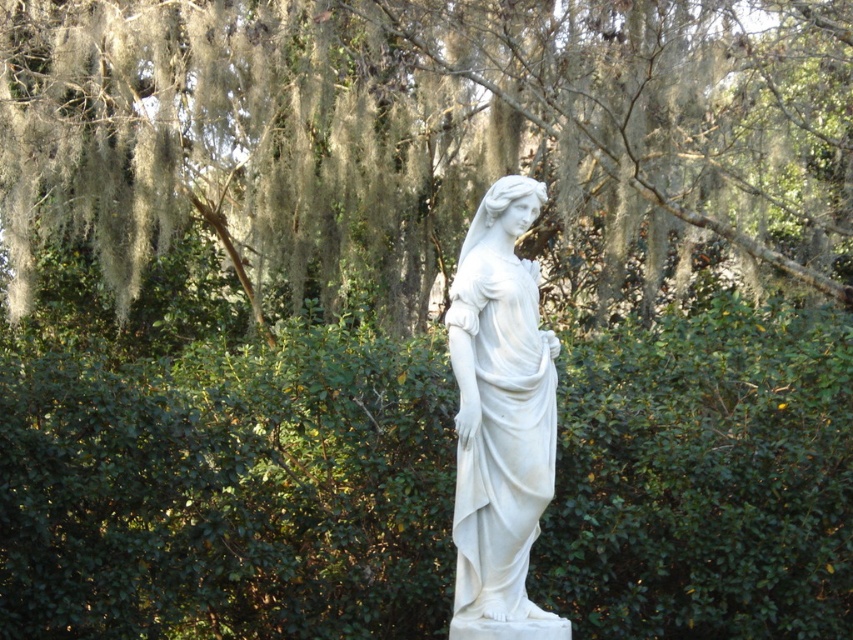
You are a gardener planning to place a new bench between the green mossy tree at center and the white marble statue at center. Given that the bench requires 1 meter of space between the two objects, can you determine if there is enough space based on their widths?

The green mossy tree at center is wider than the white marble statue at center. However, the question asks about the space between them, not their widths. Since the description only provides information about their widths and not the distance between them, it is impossible to determine if there is enough space for the bench based on the given information.

You are a gardener planning to trim the green mossy tree at center and the white marble statue at center. Which object should you approach first if you want to start from the left side of the scene?

The green mossy tree at center should be approached first because it is located to the left of the white marble statue at center, making it closer to the starting point on the left side of the scene.

You are a landscape architect designing a garden path that needs to pass between the green mossy tree at center and the white marble statue at center. Given that the statue is smaller than the tree, which object should you consider as the primary obstacle for the path width?

The green mossy tree at center is larger in size than the white marble statue at center, so the green mossy tree at center should be considered the primary obstacle for determining the path width.